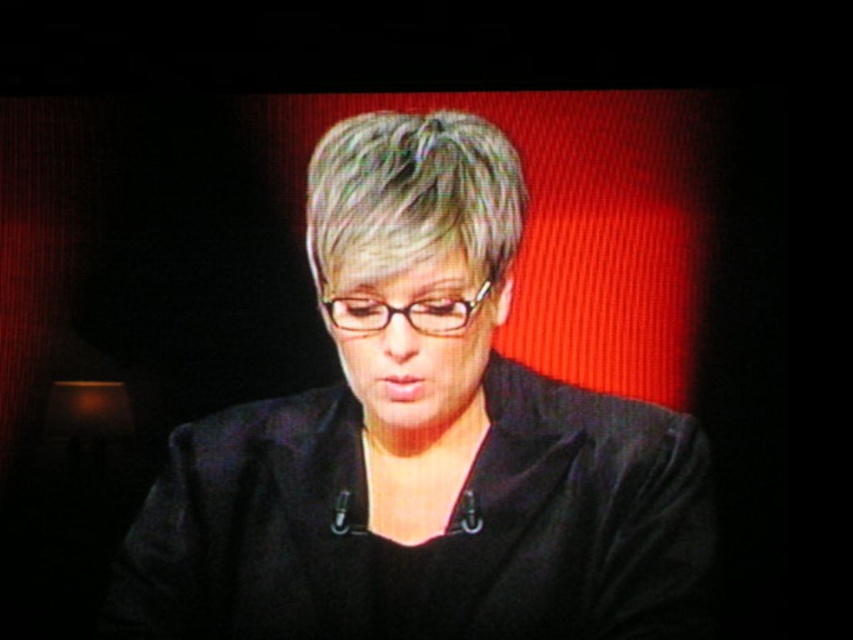
You are designing a virtual reality environment and need to ensure that the black matte jacket at center and the gray matte hair at center are positioned correctly. According to the scene description, what is the minimum distance you should set between these two objects to maintain their realistic appearance?

The minimum distance should be 14.99 centimeters because the black matte jacket at center is 14.99 centimeters away from the gray matte hair at center in the scene.

You are a fashion stylist preparing for a photoshoot. You need to adjust the placement of the black matte jacket at center and the gray matte hair at center so that the jacket is now on the right side of the hair. Based on their current positions, which object should you move and in which direction?

The black matte jacket at center is currently on the left side of the gray matte hair at center. To move the jacket to the right side of the hair, you should move the black matte jacket at center to the right.

You are a fashion designer observing a model wearing the black matte jacket at center and gray matte hair at center. From the front view, which object is closer to the camera?

The black matte jacket at center is closer to the camera because the gray matte hair at center is positioned behind it.